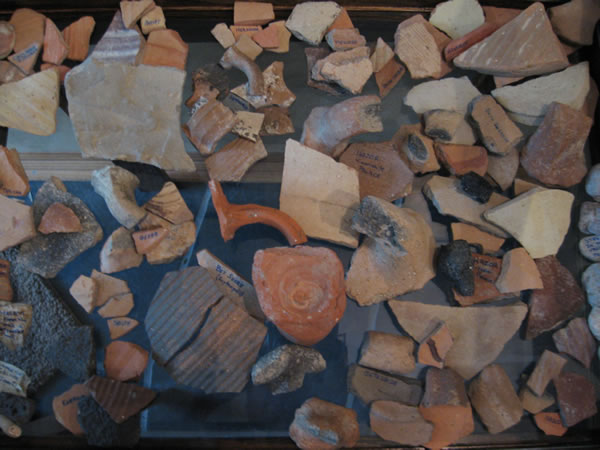
Where is `handles`? The image size is (600, 450). handles is located at coordinates point(256,217), point(246,65).